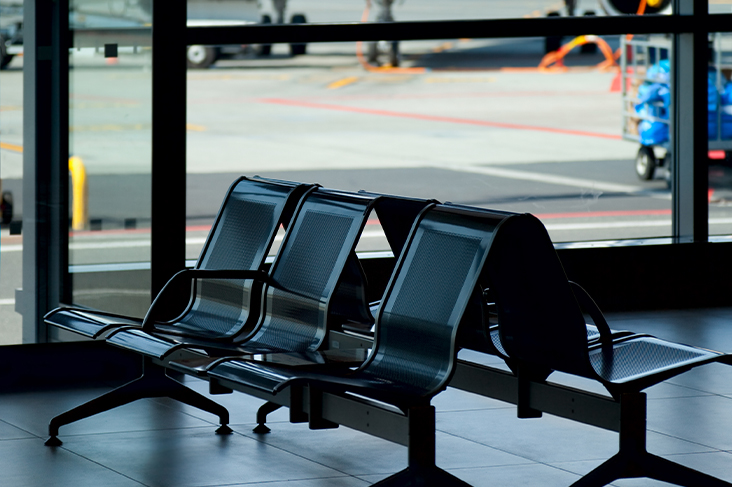
You are a GUI agent. You are given a task and a screenshot of the screen. Output one action in this format:
    pyautogui.click(x=<x>, y=<y>)
    Task: Click on the window border
    This screenshot has width=732, height=487.
    Given the screenshot: What is the action you would take?
    pyautogui.click(x=45, y=183), pyautogui.click(x=160, y=123), pyautogui.click(x=694, y=67)